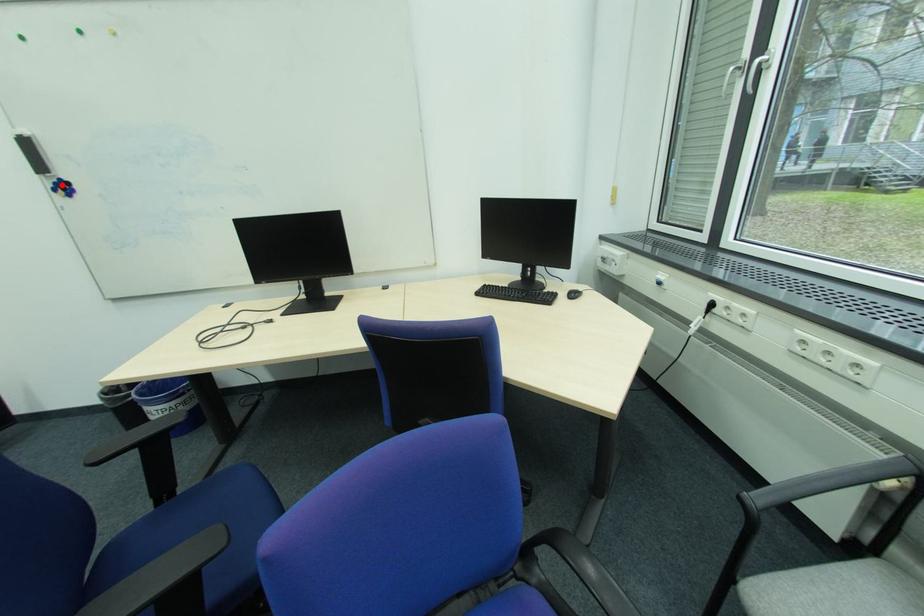
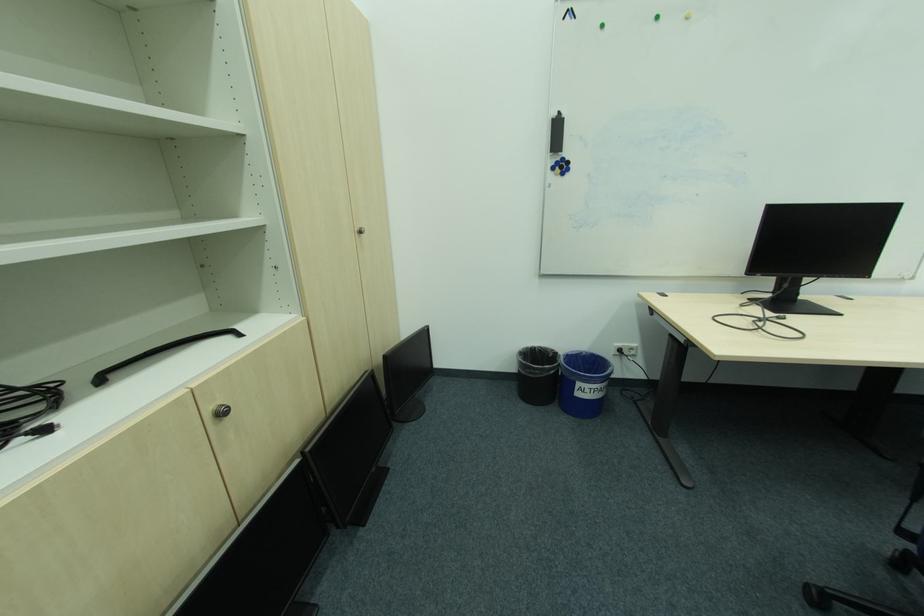
Question: I am providing you with two images of the same scene from different viewpoints. Image1 has a red point marked. In image2, the corresponding 3D location appears at what relative position? Reply with the corresponding letter.

Choices:
 (A) Closer
 (B) Farther

Answer: (A)